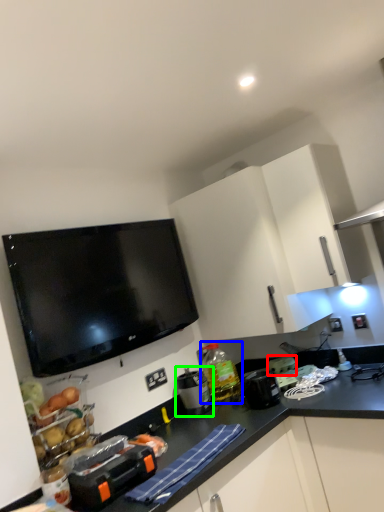
Question: Which object is the farthest from appliance (highlighted by a red box)? Choose among these: bottle (highlighted by a blue box) or appliance (highlighted by a green box).

Choices:
 (A) bottle
 (B) appliance

Answer: (B)